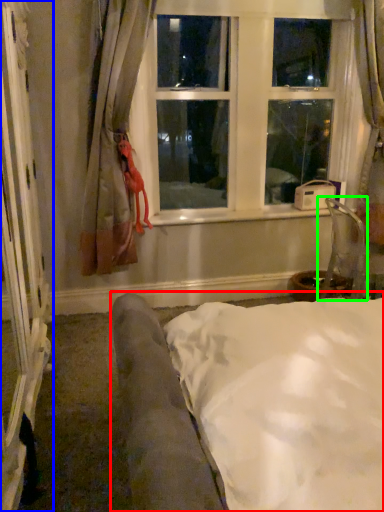
Question: Which object is the closest to the furniture (highlighted by a red box)? Choose among these: screen door (highlighted by a blue box) or armchair (highlighted by a green box).

Choices:
 (A) screen door
 (B) armchair

Answer: (A)